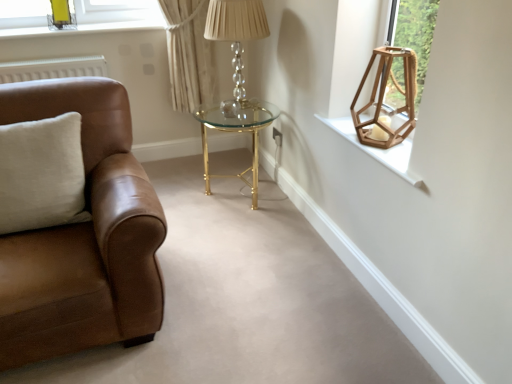
Question: Is crystal glass table lamp at center wider or thinner than brown leather couch at left?

Choices:
 (A) wide
 (B) thin

Answer: (B)

Question: Relative to brown leather couch at left, is crystal glass table lamp at center in front or behind?

Choices:
 (A) front
 (B) behind

Answer: (B)

Question: Which object is positioned farthest from the wooden hexagonal lantern at upper right, the 1th lamp in the front-to-back sequence?

Choices:
 (A) crystal glass table lamp at center
 (B) gold metallic/glass table at center
 (C) brown leather couch at left
 (D) wooden hexagonal lantern at upper right
 (E) white cotton pillow at left

Answer: (E)

Question: Which object is positioned closest to the metallic gold lamp at upper left, marked as the first lamp in a top-to-bottom arrangement?

Choices:
 (A) brown leather couch at left
 (B) wooden hexagonal lantern at upper right
 (C) gold metallic/glass table at center
 (D) wooden hexagonal lantern at upper right, placed as the 2th lamp when sorted from top to bottom
 (E) white cotton pillow at left

Answer: (C)